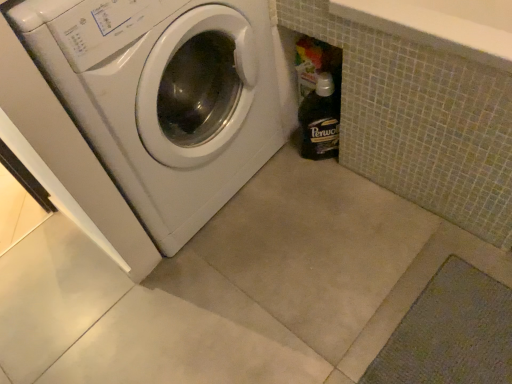
Measure the distance between white glossy washing machine at left and camera.

The distance of white glossy washing machine at left from camera is 68.57 centimeters.

The height and width of the screenshot is (384, 512). Describe the element at coordinates (165, 97) in the screenshot. I see `white glossy washing machine at left` at that location.

I want to click on white glossy washing machine at left, so click(165, 97).

Image resolution: width=512 pixels, height=384 pixels. What do you see at coordinates (319, 120) in the screenshot?
I see `black glass bottle at lower right` at bounding box center [319, 120].

Locate an element on the screen. The image size is (512, 384). black glass bottle at lower right is located at coordinates [319, 120].

Image resolution: width=512 pixels, height=384 pixels. What are the coordinates of `white glossy washing machine at left` in the screenshot? It's located at (165, 97).

Considering the positions of objects black glass bottle at lower right and white glossy washing machine at left in the image provided, who is more to the left, black glass bottle at lower right or white glossy washing machine at left?

Positioned to the left is white glossy washing machine at left.

Based on the photo, which object is closer to the camera, black glass bottle at lower right or white glossy washing machine at left?

Positioned in front is white glossy washing machine at left.

Considering the positions of points (319, 151) and (207, 110), is point (319, 151) farther from camera compared to point (207, 110)?

Yes, it is.

From the image's perspective, is black glass bottle at lower right located above or below white glossy washing machine at left?

black glass bottle at lower right is below white glossy washing machine at left.

From a real-world perspective, is black glass bottle at lower right located higher than white glossy washing machine at left?

Incorrect, from a real-world perspective, black glass bottle at lower right is lower than white glossy washing machine at left.

Does black glass bottle at lower right have a greater width compared to white glossy washing machine at left?

In fact, black glass bottle at lower right might be narrower than white glossy washing machine at left.

Considering the sizes of objects black glass bottle at lower right and white glossy washing machine at left in the image provided, who is shorter, black glass bottle at lower right or white glossy washing machine at left?

black glass bottle at lower right.

Based on their sizes in the image, would you say black glass bottle at lower right is bigger or smaller than white glossy washing machine at left?

Considering their sizes, black glass bottle at lower right takes up less space than white glossy washing machine at left.

Is black glass bottle at lower right outside of white glossy washing machine at left?

Absolutely, black glass bottle at lower right is external to white glossy washing machine at left.

Is the surface of black glass bottle at lower right in direct contact with white glossy washing machine at left?

No, black glass bottle at lower right is not touching white glossy washing machine at left.

Is black glass bottle at lower right looking in the opposite direction of white glossy washing machine at left?

No, black glass bottle at lower right's orientation is not away from white glossy washing machine at left.

The width and height of the screenshot is (512, 384). In order to click on bottle behind the white glossy washing machine at left in this screenshot , I will do `click(319, 120)`.

Considering the relative positions of white glossy washing machine at left and black glass bottle at lower right in the image provided, is white glossy washing machine at left to the left of black glass bottle at lower right from the viewer's perspective?

Yes.

In the scene shown: In the image, is white glossy washing machine at left positioned in front of or behind black glass bottle at lower right?

In the image, white glossy washing machine at left appears in front of black glass bottle at lower right.

Considering the points (193, 7) and (306, 109), which point is in front, point (193, 7) or point (306, 109)?

The point (193, 7) is closer.

From the image's perspective, would you say white glossy washing machine at left is shown under black glass bottle at lower right?

No, from the image's perspective, white glossy washing machine at left is not below black glass bottle at lower right.

From a real-world perspective, who is located lower, white glossy washing machine at left or black glass bottle at lower right?

black glass bottle at lower right, from a real-world perspective.

Considering the sizes of objects white glossy washing machine at left and black glass bottle at lower right in the image provided, who is thinner, white glossy washing machine at left or black glass bottle at lower right?

With smaller width is black glass bottle at lower right.

Can you confirm if white glossy washing machine at left is shorter than black glass bottle at lower right?

No.

Considering the sizes of objects white glossy washing machine at left and black glass bottle at lower right in the image provided, who is smaller, white glossy washing machine at left or black glass bottle at lower right?

With smaller size is black glass bottle at lower right.

Do you think white glossy washing machine at left is within black glass bottle at lower right, or outside of it?

white glossy washing machine at left is outside black glass bottle at lower right.

Would you consider white glossy washing machine at left to be distant from black glass bottle at lower right?

white glossy washing machine at left is actually quite close to black glass bottle at lower right.

Could you tell me if white glossy washing machine at left is facing black glass bottle at lower right?

No.

This screenshot has height=384, width=512. I want to click on bottle beneath the white glossy washing machine at left (from a real-world perspective), so click(319, 120).

Find the location of a particular element. The image size is (512, 384). washing machine in front of the black glass bottle at lower right is located at coordinates (165, 97).

You are a GUI agent. You are given a task and a screenshot of the screen. Output one action in this format:
    pyautogui.click(x=<x>, y=<y>)
    Task: Click on the washing machine to the left of black glass bottle at lower right
    This screenshot has width=512, height=384.
    Given the screenshot: What is the action you would take?
    pyautogui.click(x=165, y=97)